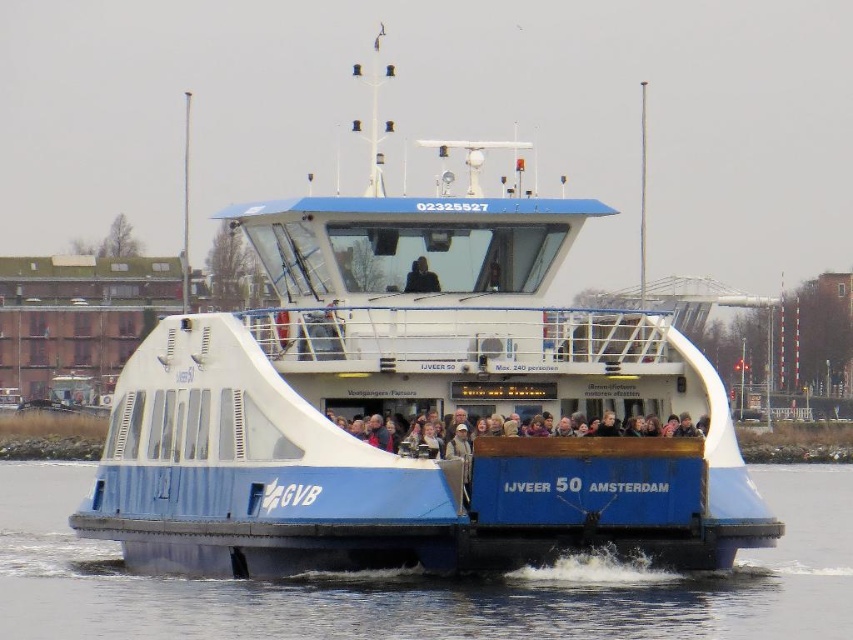
Question: Does blue smooth water at center have a larger size compared to dark blue fabric jacket at center?

Choices:
 (A) no
 (B) yes

Answer: (B)

Question: Which object appears closest to the camera in this image?

Choices:
 (A) light brown wooden bench at center
 (B) dark blue fabric jacket at center

Answer: (A)

Question: Which of the following is the closest to the observer?

Choices:
 (A) (426, 266)
 (B) (688, 442)

Answer: (B)

Question: Is blue matte ferry at center closer to camera compared to dark blue fabric jacket at center?

Choices:
 (A) yes
 (B) no

Answer: (A)

Question: Which point is closer to the camera taking this photo?

Choices:
 (A) (701, 374)
 (B) (431, 276)
 (C) (525, 596)

Answer: (C)

Question: Does blue matte ferry at center appear on the right side of blue smooth water at center?

Choices:
 (A) no
 (B) yes

Answer: (A)